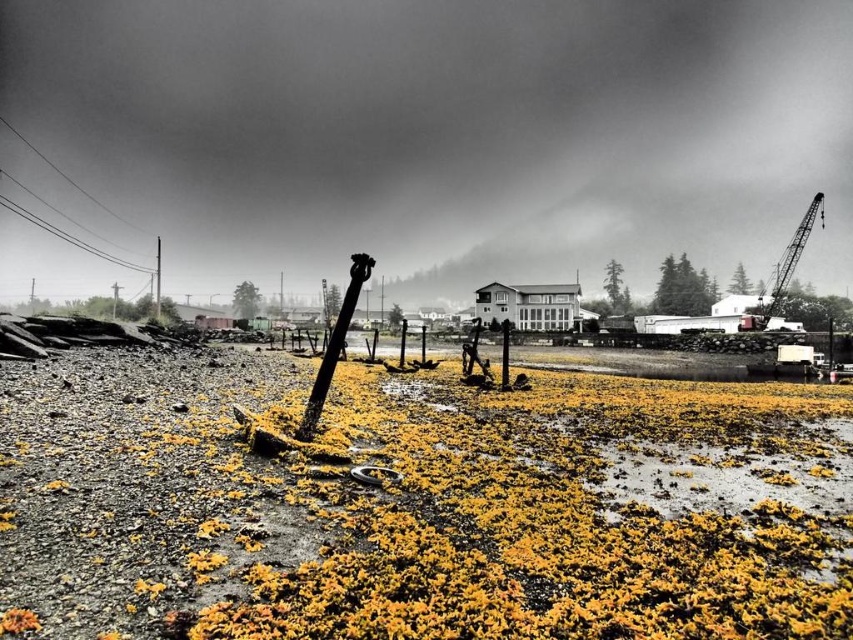
You are a photographer planning to capture a symmetrical composition using the metallic gray crane at upper right and the brushed metal telegraph pole at upper left. Based on their positions, can you position yourself so that both objects are aligned symmetrically along the horizontal axis?

The metallic gray crane at upper right is to the right of the brushed metal telegraph pole at upper left, so positioning yourself equidistant between them would allow for a symmetrical composition along the horizontal axis.

You are a photographer planning to capture the coastal scene. You want to ensure that both the yellow mossy mud at center and the metallic gray crane at upper right are clearly visible in your shot. Given their positions, which object should you focus on first to ensure both are in sharp focus?

The yellow mossy mud at center is closer to the viewer than the metallic gray crane at upper right. To ensure both are in sharp focus, you should focus on the yellow mossy mud at center first, as it is closer, and the crane will fall into the depth of field naturally.

You are a bird soaring above the coastal scene. You want to land on the tallest structure you can find. Which one should you choose between the metallic gray crane at upper right and the brushed metal telegraph pole at upper left?

The metallic gray crane at upper right is much taller than the brushed metal telegraph pole at upper left, so you should land on the metallic gray crane at upper right.